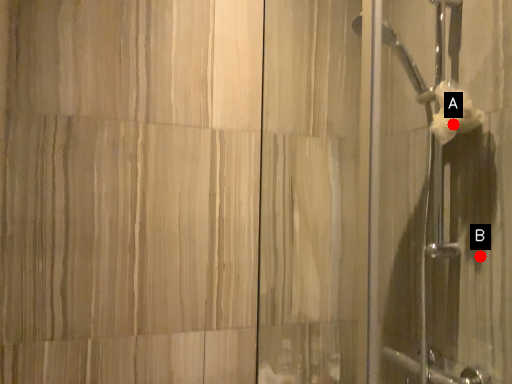
Question: Two points are circled on the image, labeled by A and B beside each circle. Among these points, which one is farthest from the camera?

Choices:
 (A) A is further
 (B) B is further

Answer: (A)